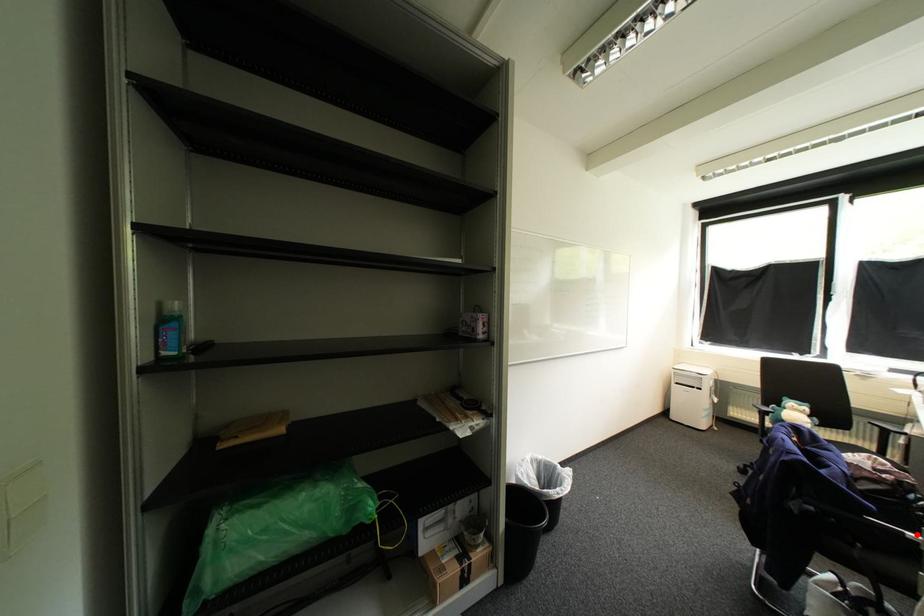
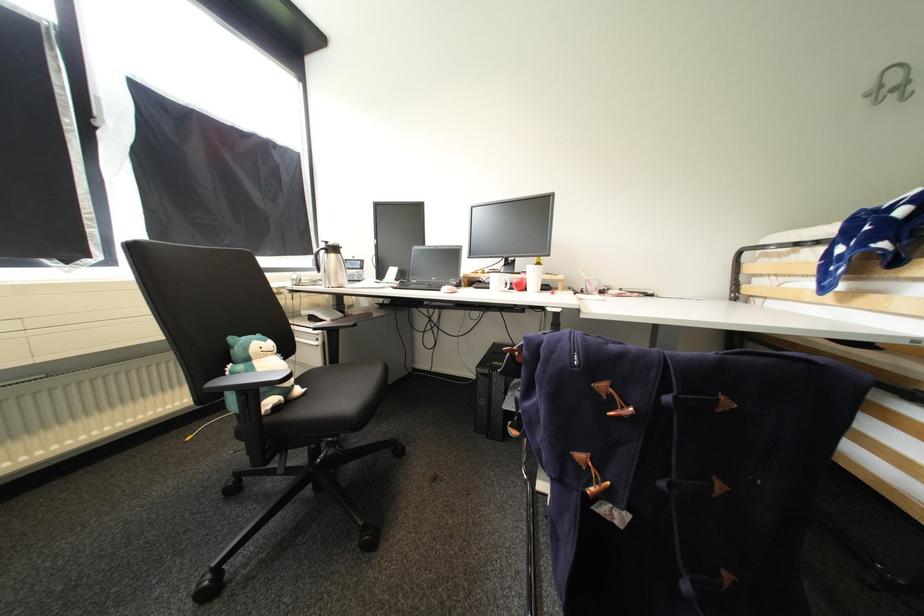
Question: I am providing you with two images of the same scene from different viewpoints. A red point is marked on the first image. Is the red point's position out of view in image 2?

Choices:
 (A) Yes
 (B) No

Answer: (A)